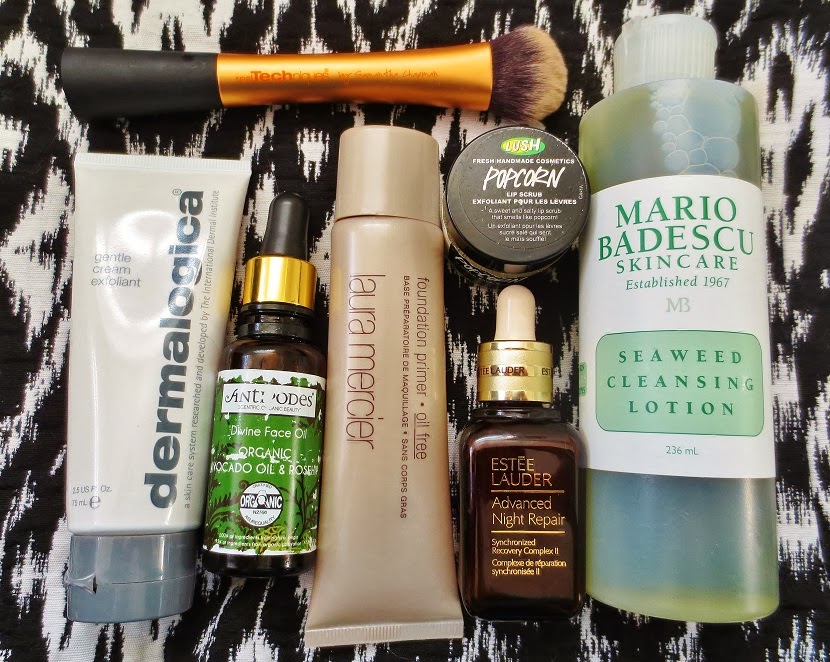
What are the coordinates of `blanket` in the screenshot? It's located at (37, 318).